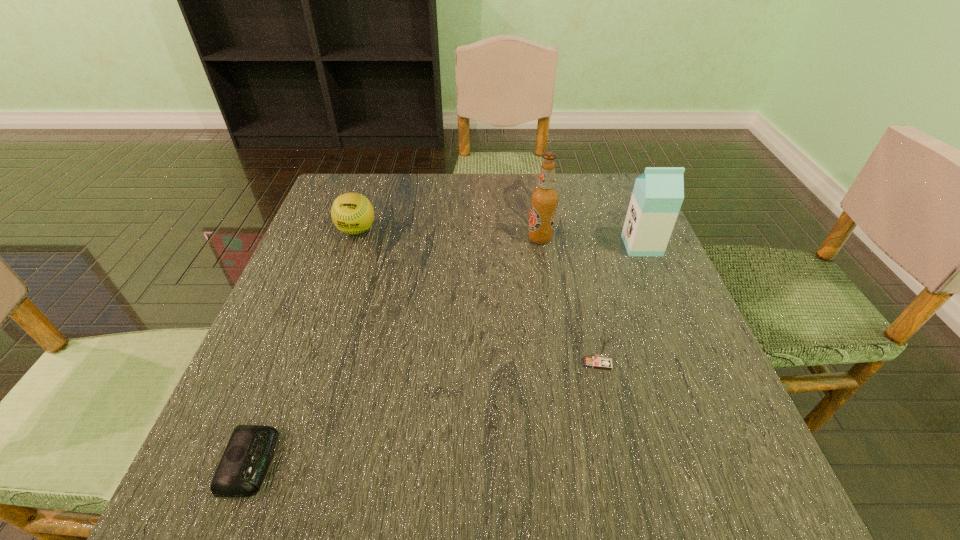
Locate an element on the screen. The width and height of the screenshot is (960, 540). object located in the near left corner section of the desktop is located at coordinates (240, 473).

In the image, there is a desktop. Identify the location of vacant space at the far edge. The image size is (960, 540). (474, 186).

In order to click on vacant space at the near edge of the desktop in this screenshot , I will do `click(388, 469)`.

Find the location of a particular element. Image resolution: width=960 pixels, height=540 pixels. vacant space at the left edge is located at coordinates point(308,277).

This screenshot has height=540, width=960. In the image, there is a desktop. What are the coordinates of `vacant area at the right edge` in the screenshot? It's located at (684, 440).

Find the location of a particular element. The image size is (960, 540). vacant region at the near left corner of the desktop is located at coordinates (261, 494).

I want to click on free space at the far right corner of the desktop, so click(588, 213).

Where is `vacant space that's between the matchbox and the softball`? The width and height of the screenshot is (960, 540). vacant space that's between the matchbox and the softball is located at coordinates (477, 296).

Find the location of a particular element. This screenshot has height=540, width=960. free space between the beer bottle and the shortest object is located at coordinates (396, 350).

I want to click on vacant space that's between the milk carton and the third object from left to right, so click(590, 242).